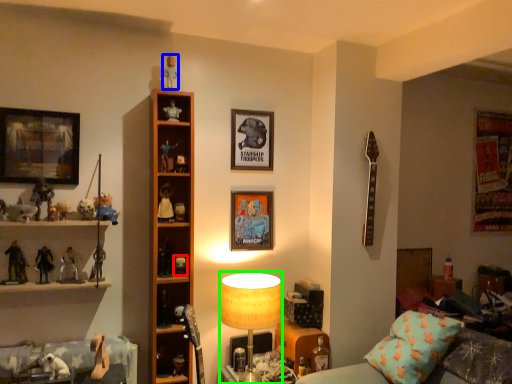
Question: Which object is the farthest from toy (highlighted by a red box)? Choose among these: toy (highlighted by a blue box) or table lamp (highlighted by a green box).

Choices:
 (A) toy
 (B) table lamp

Answer: (A)